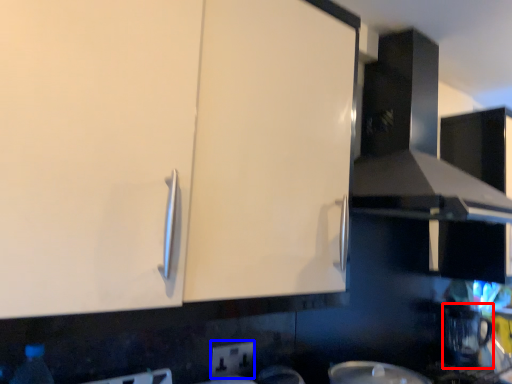
Question: Which point is further to the camera, coffee machine (highlighted by a red box) or electric outlet (highlighted by a blue box)?

Choices:
 (A) coffee machine
 (B) electric outlet

Answer: (A)